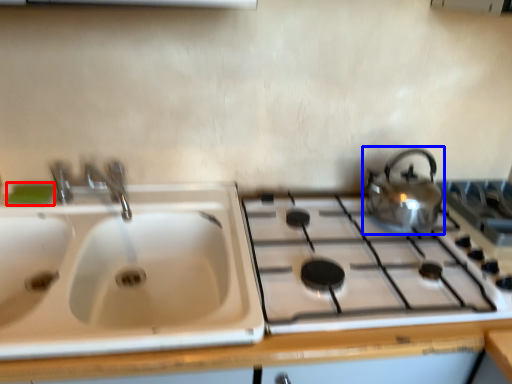
Question: Which object appears farthest to the camera in this image, soap (highlighted by a red box) or kettle (highlighted by a blue box)?

Choices:
 (A) soap
 (B) kettle

Answer: (A)